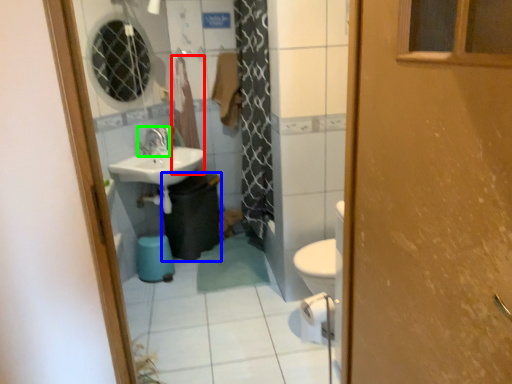
Question: Which object is the farthest from curtain (highlighted by a red box)? Choose among these: garbage (highlighted by a blue box) or tap (highlighted by a green box).

Choices:
 (A) garbage
 (B) tap

Answer: (A)